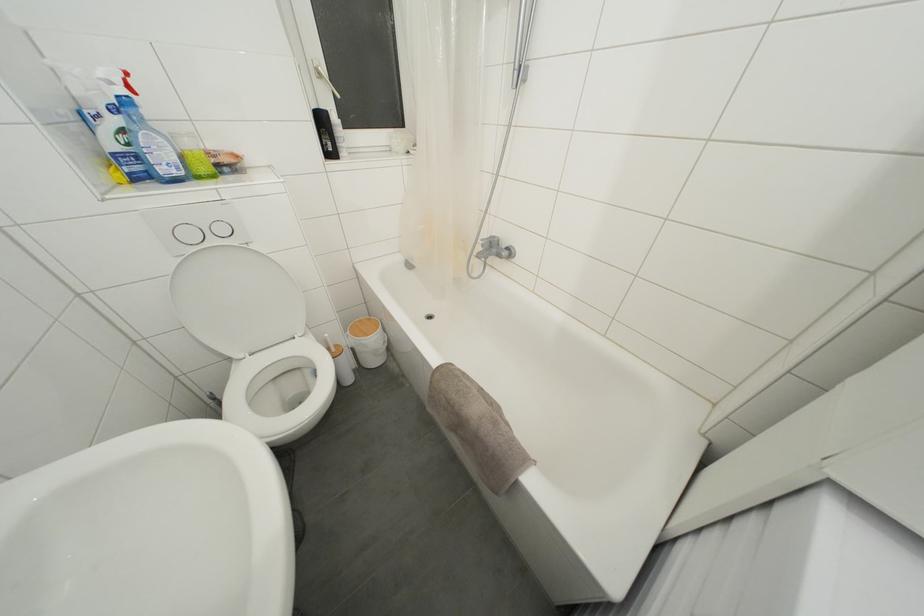
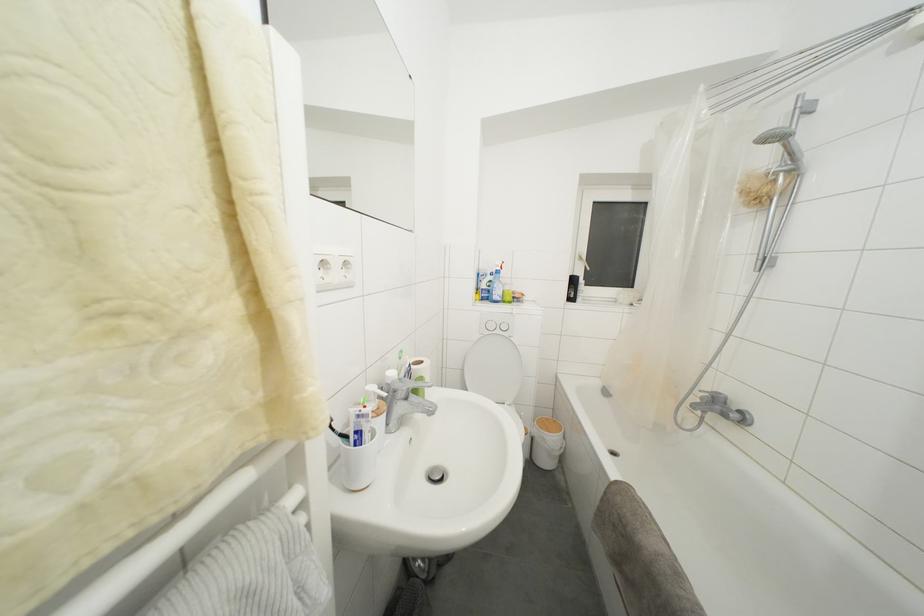
Find the pixel in the second image that matches [363,326] in the first image.

(552, 424)